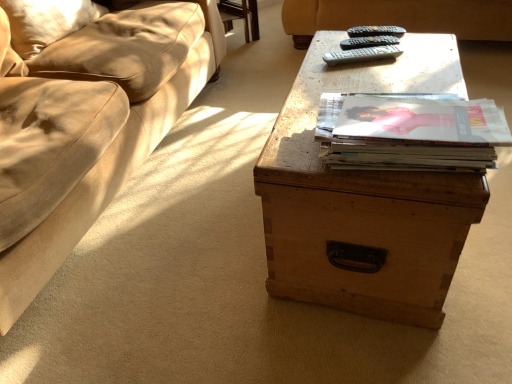
At what (x,y) coordinates should I click in order to perform the action: click on vacant region to the left of black plastic remote at upper center, arranged as the 2th remote when viewed from the top. Please return your answer as a coordinate pair (x, y). The image size is (512, 384). Looking at the image, I should click on (324, 51).